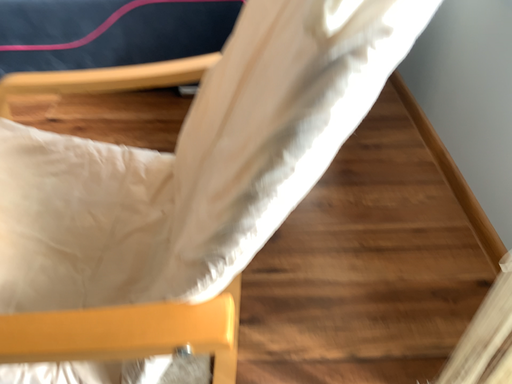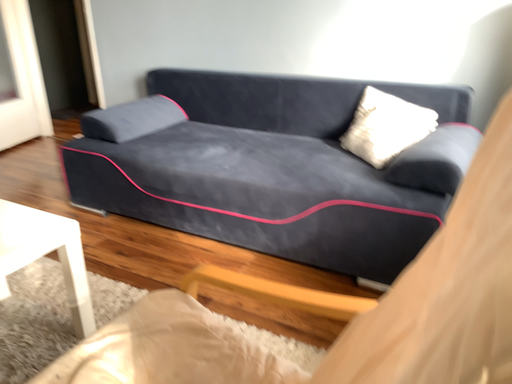
Question: How did the camera likely rotate when shooting the video?

Choices:
 (A) rotated right
 (B) rotated left

Answer: (B)